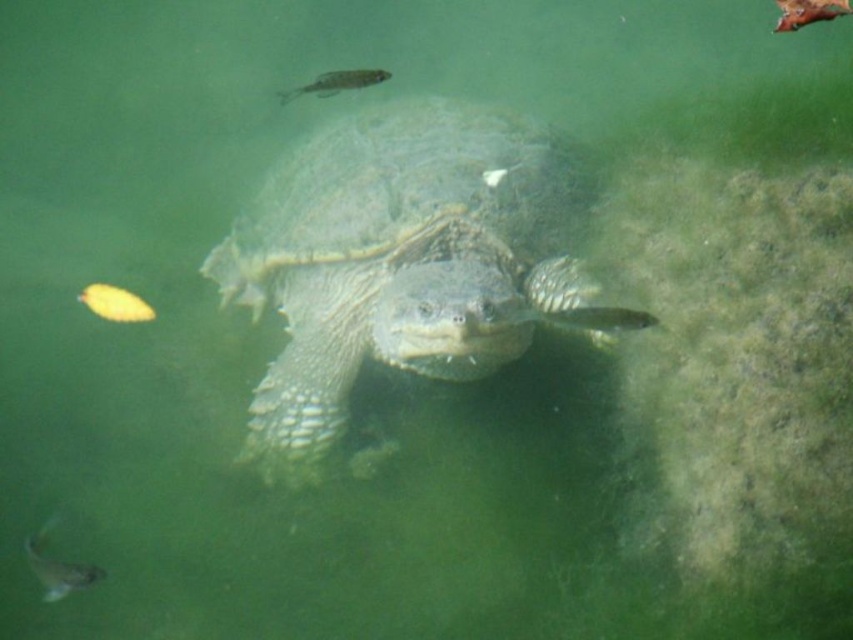
Question: Observing the image, what is the correct spatial positioning of shiny silver fish at lower left in reference to yellow matte fish at lower left?

Choices:
 (A) right
 (B) left

Answer: (A)

Question: Which point is farther from the camera taking this photo?

Choices:
 (A) (351, 77)
 (B) (119, 296)
 (C) (331, 184)
 (D) (33, 554)

Answer: (B)

Question: Which is nearer to the shiny silver fish at upper center?

Choices:
 (A) leathery brown tortoise at center
 (B) yellow matte fish at lower left
 (C) shiny silver fish at lower left

Answer: (A)

Question: In this image, where is yellow matte fish at lower left located relative to shiny silver fish at upper center?

Choices:
 (A) below
 (B) above

Answer: (A)

Question: Is leathery brown tortoise at center thinner than shiny silver fish at lower left?

Choices:
 (A) no
 (B) yes

Answer: (A)

Question: Which point is closer to the camera?

Choices:
 (A) (529, 131)
 (B) (70, 580)
 (C) (345, 83)

Answer: (C)